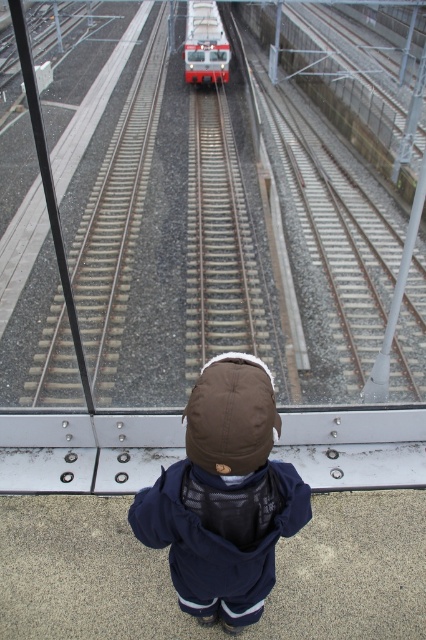
Question: Is brown fleece jacket at center further to camera compared to red glossy train at center?

Choices:
 (A) yes
 (B) no

Answer: (B)

Question: Is the position of brown fleece jacket at center less distant than that of red glossy train at center?

Choices:
 (A) yes
 (B) no

Answer: (A)

Question: Which of the following is the farthest from the observer?

Choices:
 (A) brown fleece jacket at center
 (B) red glossy train at center

Answer: (B)

Question: Which of the following is the closest to the observer?

Choices:
 (A) (218, 64)
 (B) (192, 509)

Answer: (B)

Question: Does brown fleece jacket at center appear on the right side of red glossy train at center?

Choices:
 (A) no
 (B) yes

Answer: (B)

Question: Which point is closer to the camera?

Choices:
 (A) brown fleece jacket at center
 (B) red glossy train at center

Answer: (A)